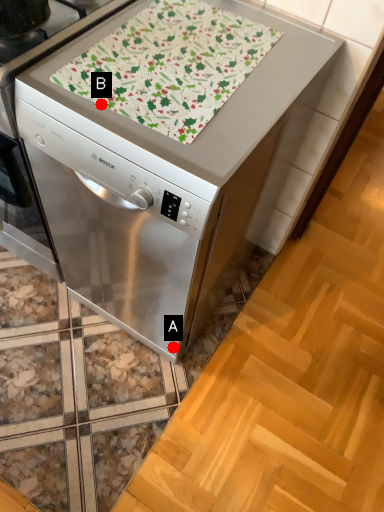
Question: Two points are circled on the image, labeled by A and B beside each circle. Which point appears farthest from the camera in this image?

Choices:
 (A) A is further
 (B) B is further

Answer: (A)